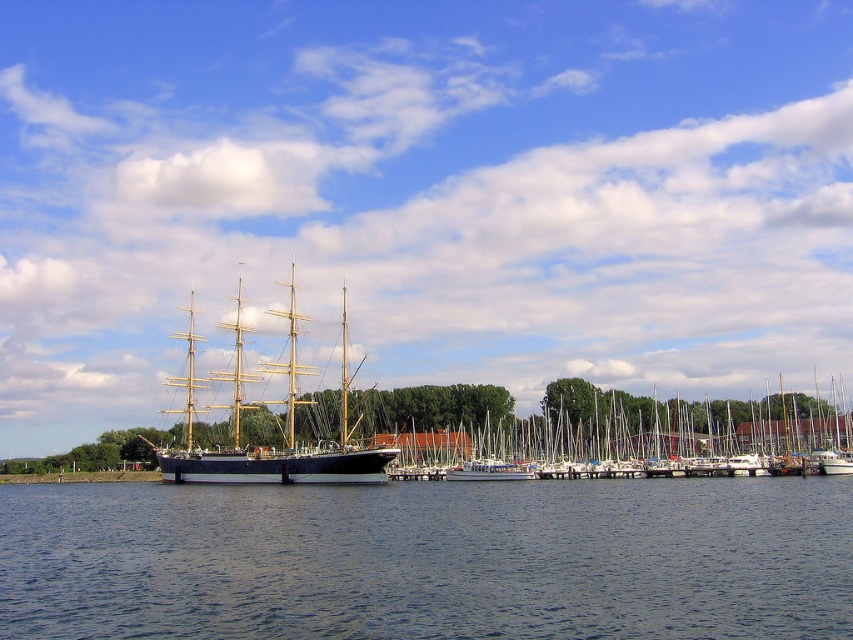
Is blue water at center shorter than wooden sailboat at center?

Yes.

What do you see at coordinates (428, 560) in the screenshot?
I see `blue water at center` at bounding box center [428, 560].

Who is more distant from viewer, (384, 554) or (564, 468)?

The point (564, 468) is behind.

Where is `blue water at center`? The image size is (853, 640). blue water at center is located at coordinates (428, 560).

Can you confirm if wooden sailboat at center is thinner than wooden ship at center?

Incorrect, wooden sailboat at center's width is not less than wooden ship at center's.

This screenshot has height=640, width=853. What do you see at coordinates (647, 435) in the screenshot?
I see `wooden sailboat at center` at bounding box center [647, 435].

Find the location of a particular element. This screenshot has width=853, height=640. wooden sailboat at center is located at coordinates (647, 435).

From the picture: Is blue water at center further to the viewer compared to wooden ship at center?

No, it is in front of wooden ship at center.

Does blue water at center appear on the left side of wooden ship at center?

Incorrect, blue water at center is not on the left side of wooden ship at center.

The image size is (853, 640). Find the location of `blue water at center`. blue water at center is located at coordinates (428, 560).